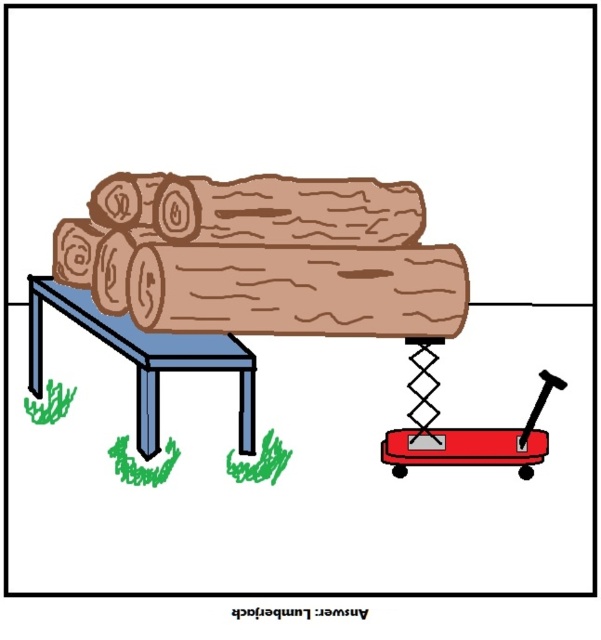
Question: Which of the following is the closest to the observer?

Choices:
 (A) red plastic wagon at lower right
 (B) blue metal table at lower left

Answer: (B)

Question: Which object appears closest to the camera in this image?

Choices:
 (A) blue metal table at lower left
 (B) red plastic wagon at lower right

Answer: (A)

Question: Is blue metal table at lower left below red plastic wagon at lower right?

Choices:
 (A) no
 (B) yes

Answer: (A)

Question: Can you confirm if blue metal table at lower left is smaller than red plastic wagon at lower right?

Choices:
 (A) no
 (B) yes

Answer: (A)

Question: Can you confirm if blue metal table at lower left is thinner than red plastic wagon at lower right?

Choices:
 (A) no
 (B) yes

Answer: (A)